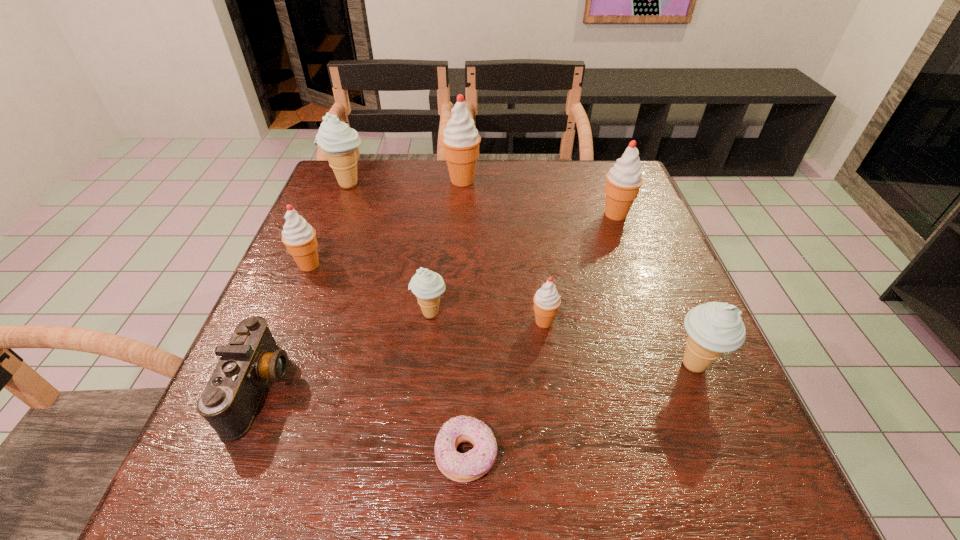
Identify which icecream is the second nearest to the camera. Please provide its 2D coordinates. Your answer should be formatted as a tuple, i.e. [(x, y)], where the tuple contains the x and y coordinates of a point satisfying the conditions above.

[(427, 285)]

Select which red icecream appears as the second closest to the tallest object. Please provide its 2D coordinates. Your answer should be formatted as a tuple, i.e. [(x, y)], where the tuple contains the x and y coordinates of a point satisfying the conditions above.

[(299, 237)]

Identify which red icecream is located as the nearest to the seventh nearest object. Please provide its 2D coordinates. Your answer should be formatted as a tuple, i.e. [(x, y)], where the tuple contains the x and y coordinates of a point satisfying the conditions above.

[(460, 139)]

I want to click on beige icecream that is the second closest to the fourth nearest icecream, so click(339, 142).

Select which beige icecream appears as the closest to the rightmost beige icecream. Please provide its 2D coordinates. Your answer should be formatted as a tuple, i.e. [(x, y)], where the tuple contains the x and y coordinates of a point satisfying the conditions above.

[(427, 285)]

Where is `free space in the image that satisfies the following two spatial constraints: 1. on the front side of the second nearest beige icecream; 2. on the lens of the second shortest object`? free space in the image that satisfies the following two spatial constraints: 1. on the front side of the second nearest beige icecream; 2. on the lens of the second shortest object is located at coordinates (422, 388).

Find the location of a particular element. vacant space that satisfies the following two spatial constraints: 1. on the front side of the leftmost beige icecream; 2. on the lens of the eighth tallest object is located at coordinates (268, 388).

In order to click on vacant space that satisfies the following two spatial constraints: 1. on the front side of the smallest beige icecream; 2. on the lens of the eighth tallest object in this screenshot , I will do `click(422, 388)`.

Where is `free space that satisfies the following two spatial constraints: 1. on the lens of the second shortest object; 2. on the right side of the shortest object`? free space that satisfies the following two spatial constraints: 1. on the lens of the second shortest object; 2. on the right side of the shortest object is located at coordinates (233, 455).